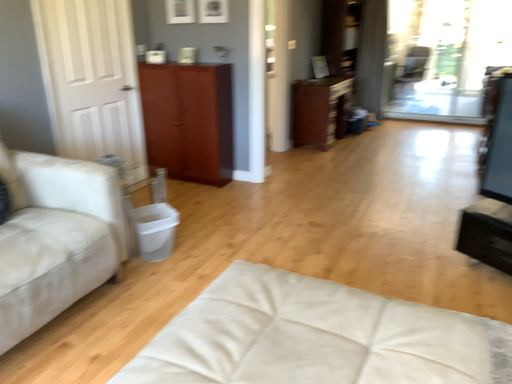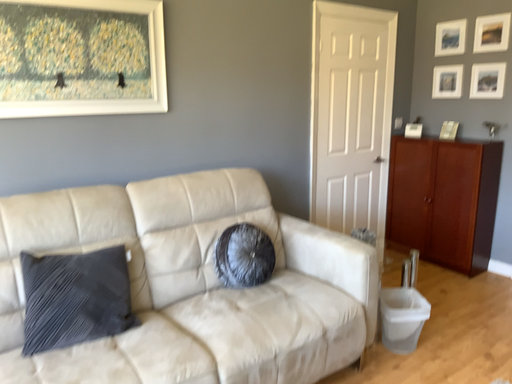
Question: How did the camera likely rotate when shooting the video?

Choices:
 (A) rotated right
 (B) rotated left

Answer: (B)